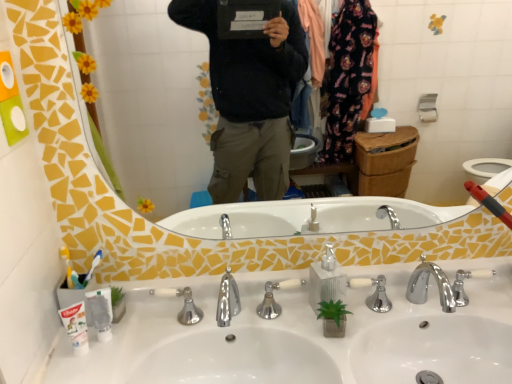
Question: Does white plastic toothbrush at left have a lesser height compared to polished chrome faucet at center?

Choices:
 (A) no
 (B) yes

Answer: (B)

Question: Can you confirm if white plastic toothbrush at left is bigger than polished chrome faucet at center?

Choices:
 (A) no
 (B) yes

Answer: (A)

Question: Is white plastic toothbrush at left turned away from polished chrome faucet at center?

Choices:
 (A) no
 (B) yes

Answer: (A)

Question: Does white plastic toothbrush at left have a greater height compared to polished chrome faucet at center?

Choices:
 (A) yes
 (B) no

Answer: (B)

Question: Considering the relative sizes of white plastic toothbrush at left and polished chrome faucet at center in the image provided, is white plastic toothbrush at left thinner than polished chrome faucet at center?

Choices:
 (A) no
 (B) yes

Answer: (B)

Question: Considering the positions of polished chrome faucet at center and white matte toothpaste at lower left in the image, is polished chrome faucet at center bigger or smaller than white matte toothpaste at lower left?

Choices:
 (A) small
 (B) big

Answer: (B)

Question: Which is correct: polished chrome faucet at center is inside white matte toothpaste at lower left, or outside of it?

Choices:
 (A) outside
 (B) inside

Answer: (A)

Question: From the image's perspective, relative to white matte toothpaste at lower left, is polished chrome faucet at center above or below?

Choices:
 (A) above
 (B) below

Answer: (A)

Question: Considering the positions of polished chrome faucet at center and white matte toothpaste at lower left in the image, is polished chrome faucet at center taller or shorter than white matte toothpaste at lower left?

Choices:
 (A) tall
 (B) short

Answer: (A)

Question: Is point (226, 269) positioned closer to the camera than point (314, 296)?

Choices:
 (A) closer
 (B) farther

Answer: (B)

Question: Relative to silver metallic soap dispenser at center, is polished chrome faucet at center in front or behind?

Choices:
 (A) behind
 (B) front

Answer: (B)

Question: Looking at their shapes, would you say polished chrome faucet at center is wider or thinner than silver metallic soap dispenser at center?

Choices:
 (A) thin
 (B) wide

Answer: (B)

Question: From the image's perspective, is polished chrome faucet at center located above or below silver metallic soap dispenser at center?

Choices:
 (A) above
 (B) below

Answer: (B)

Question: In the image, is yellow mosaic mirror at upper center positioned in front of or behind polished chrome faucet at center?

Choices:
 (A) front
 (B) behind

Answer: (A)

Question: Is yellow mosaic mirror at upper center wider or thinner than polished chrome faucet at center?

Choices:
 (A) wide
 (B) thin

Answer: (B)